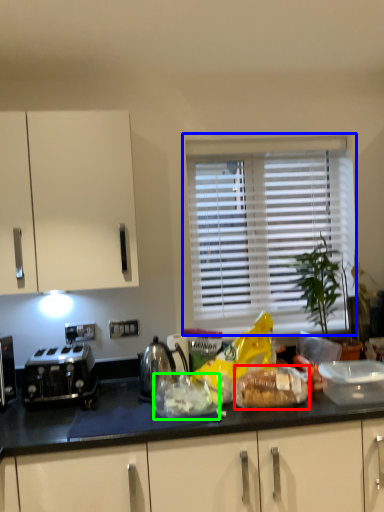
Question: Which is farther away from food (highlighted by a red box)? window (highlighted by a blue box) or food (highlighted by a green box)?

Choices:
 (A) window
 (B) food

Answer: (A)